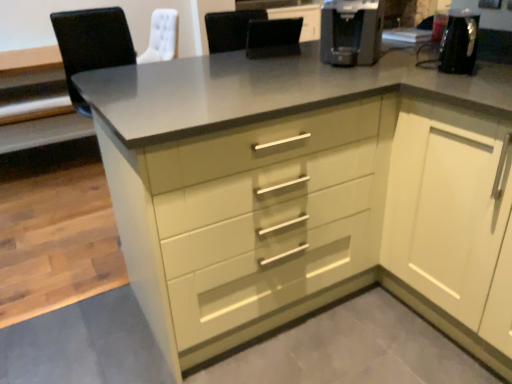
Question: Does black leather chair at center come behind black plastic coffee machine at upper right?

Choices:
 (A) yes
 (B) no

Answer: (A)

Question: Is black leather chair at center completely or partially outside of black plastic coffee machine at upper right?

Choices:
 (A) yes
 (B) no

Answer: (A)

Question: Considering the relative positions of black leather chair at center and black plastic coffee machine at upper right in the image provided, is black leather chair at center to the right of black plastic coffee machine at upper right from the viewer's perspective?

Choices:
 (A) no
 (B) yes

Answer: (A)

Question: Does black leather chair at center have a greater height compared to black plastic coffee machine at upper right?

Choices:
 (A) yes
 (B) no

Answer: (B)

Question: Can you confirm if black leather chair at center is positioned to the left of black plastic coffee machine at upper right?

Choices:
 (A) yes
 (B) no

Answer: (A)

Question: Does point (333, 41) appear closer or farther from the camera than point (412, 107)?

Choices:
 (A) closer
 (B) farther

Answer: (B)

Question: In terms of size, does black plastic coffee machine at upper right appear bigger or smaller than white glossy cabinet at right?

Choices:
 (A) big
 (B) small

Answer: (B)

Question: Considering the positions of black plastic coffee machine at upper right and white glossy cabinet at right in the image, is black plastic coffee machine at upper right taller or shorter than white glossy cabinet at right?

Choices:
 (A) short
 (B) tall

Answer: (A)

Question: In the image, is black plastic coffee machine at upper right positioned in front of or behind white glossy cabinet at right?

Choices:
 (A) front
 (B) behind

Answer: (B)

Question: Looking at the image, does white glossy cabinet at right seem bigger or smaller compared to black leather chair at center?

Choices:
 (A) small
 (B) big

Answer: (B)

Question: Is point (480, 182) closer or farther from the camera than point (291, 34)?

Choices:
 (A) farther
 (B) closer

Answer: (B)

Question: From the image's perspective, is white glossy cabinet at right above or below black leather chair at center?

Choices:
 (A) above
 (B) below

Answer: (B)

Question: Looking at their shapes, would you say white glossy cabinet at right is wider or thinner than black leather chair at center?

Choices:
 (A) thin
 (B) wide

Answer: (B)

Question: From their relative heights in the image, would you say black leather chair at center is taller or shorter than black plastic coffee machine at upper right?

Choices:
 (A) short
 (B) tall

Answer: (A)

Question: Looking at the image, does black leather chair at center seem bigger or smaller compared to black plastic coffee machine at upper right?

Choices:
 (A) big
 (B) small

Answer: (B)